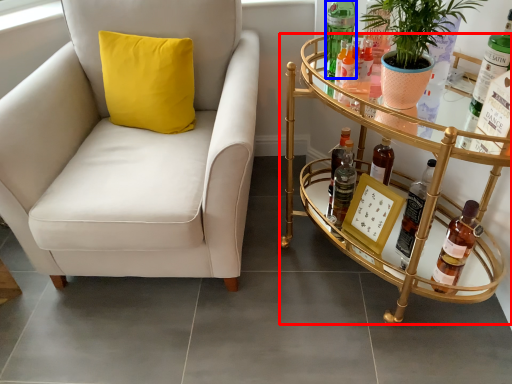
Question: Which point is further to the camera, table (highlighted by a red box) or bottle (highlighted by a blue box)?

Choices:
 (A) table
 (B) bottle

Answer: (B)